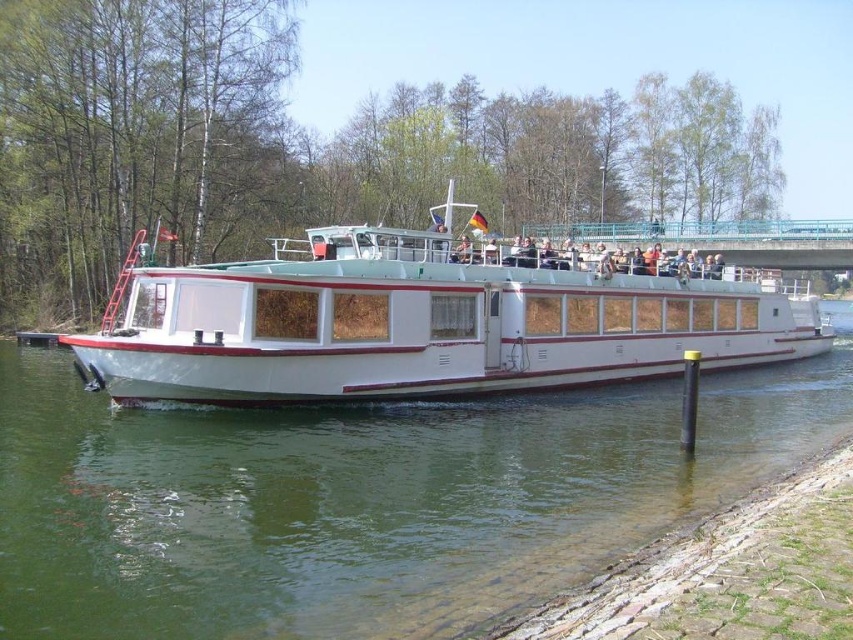
You are a passenger on the white glossy boat at center and want to take a photo of the blue metallic bridge at upper center. Since the boat is much taller than the bridge, will the bridge be fully visible in your photo from your current position?

The white glossy boat at center is much taller than the blue metallic bridge at upper center. Since the boat is higher, the bridge might be partially obscured by the boat itself when taking the photo from your current position on the boat.

You are a passenger on the white river cruise boat with red trim. You want to take a photo of the green water at lower left and the blue metallic bridge at upper center. Which object should you focus on first if you want to capture both in one frame without moving the camera?

You should focus on the blue metallic bridge at upper center first because it is taller than the green water at lower left, allowing both to fit in the frame when centered on the taller object.